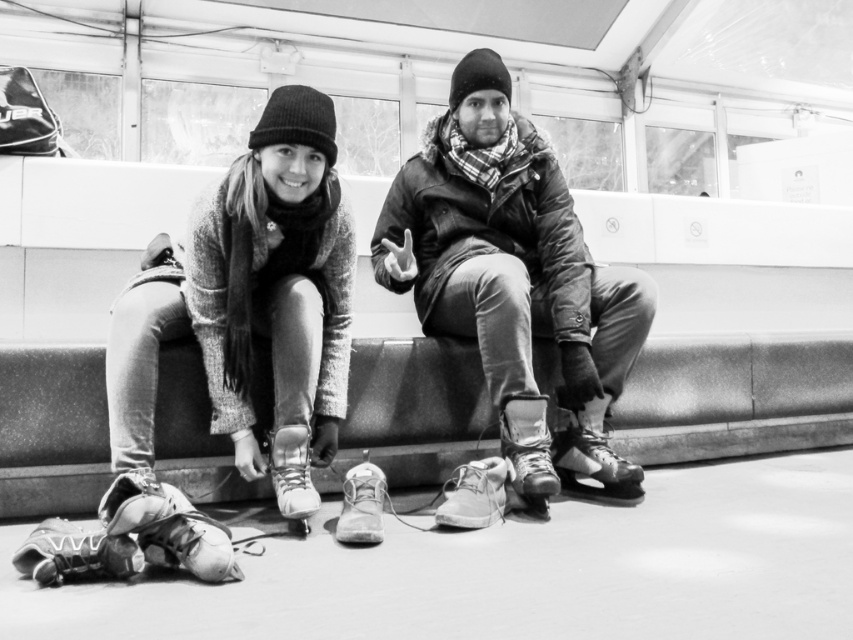
Which is behind, point (508, 221) or point (299, 490)?

The point (508, 221) is behind.

Is matte black jacket at center above leather boot at lower center?

Yes.

I want to click on matte black jacket at center, so click(x=508, y=250).

Consider the image. Between matte black jacket at center and leather shoe at center, which one is positioned lower?

leather shoe at center

The image size is (853, 640). Find the location of `matte black jacket at center`. matte black jacket at center is located at coordinates (508, 250).

Between point (445, 202) and point (474, 504), which one is positioned in front?

Point (474, 504) is in front.

Where is `matte black jacket at center`? The image size is (853, 640). matte black jacket at center is located at coordinates (508, 250).

Is point (184, 540) closer to camera compared to point (473, 474)?

Yes, point (184, 540) is in front of point (473, 474).

Is leather lace-up shoe at lower left positioned at the back of leather shoe at center?

No, leather lace-up shoe at lower left is in front of leather shoe at center.

Between point (154, 540) and point (466, 470), which one is positioned behind?

Positioned behind is point (466, 470).

This screenshot has height=640, width=853. I want to click on leather lace-up shoe at lower left, so click(x=167, y=525).